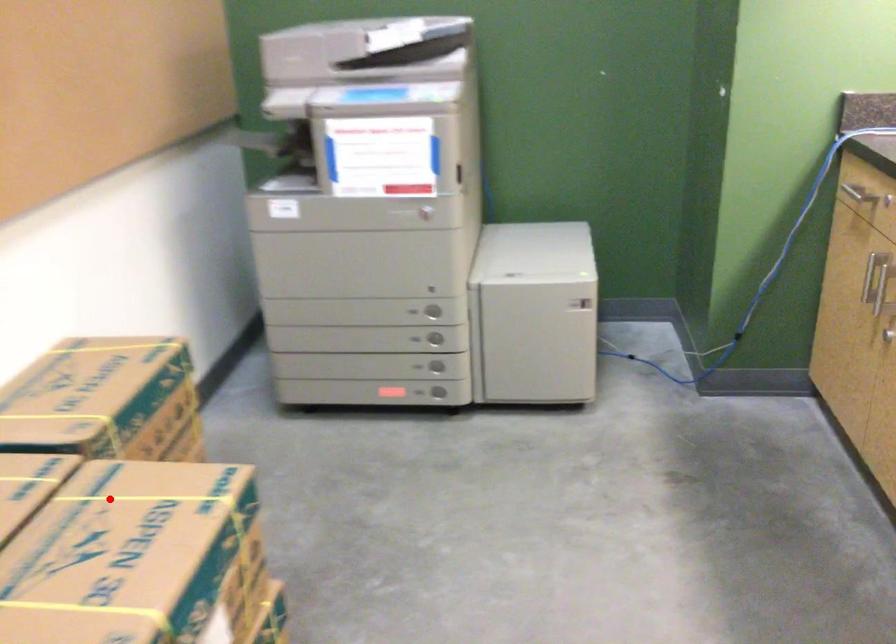
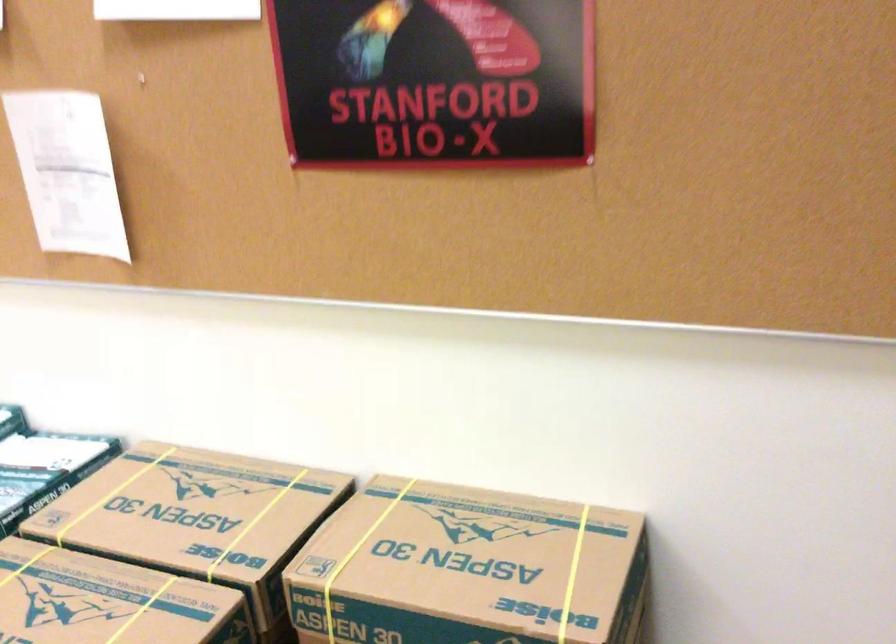
In the second image, find the point that corresponds to the highlighted location in the first image.

(142, 609)